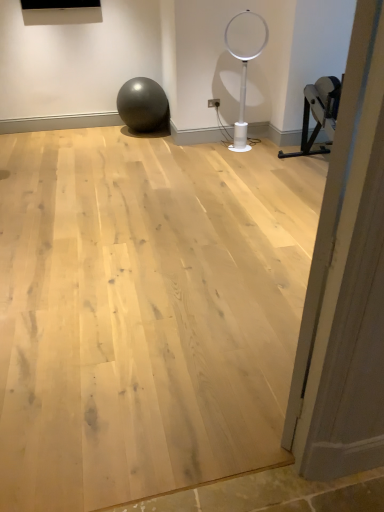
Question: In the image, is matte gray ball at center positioned in front of or behind white plastic basketball hoop at center?

Choices:
 (A) front
 (B) behind

Answer: (B)

Question: Looking at their shapes, would you say matte gray ball at center is wider or thinner than white plastic basketball hoop at center?

Choices:
 (A) thin
 (B) wide

Answer: (B)

Question: Which of these objects is positioned farthest from the natural wood floor at center?

Choices:
 (A) wooden door at right
 (B) white plastic basketball hoop at center
 (C) matte gray ball at center

Answer: (C)

Question: Estimate the real-world distances between objects in this image. Which object is farther from the wooden door at right?

Choices:
 (A) natural wood floor at center
 (B) matte gray ball at center
 (C) white plastic basketball hoop at center

Answer: (B)